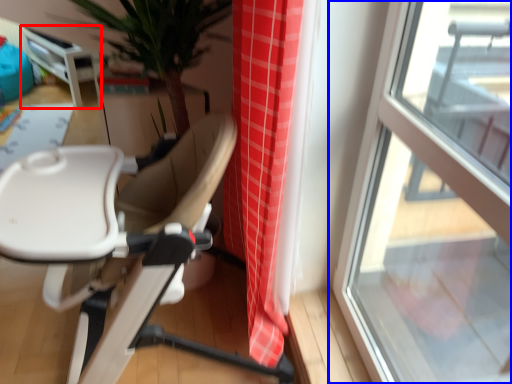
Question: Among these objects, which one is nearest to the camera, table (highlighted by a red box) or window (highlighted by a blue box)?

Choices:
 (A) table
 (B) window

Answer: (B)